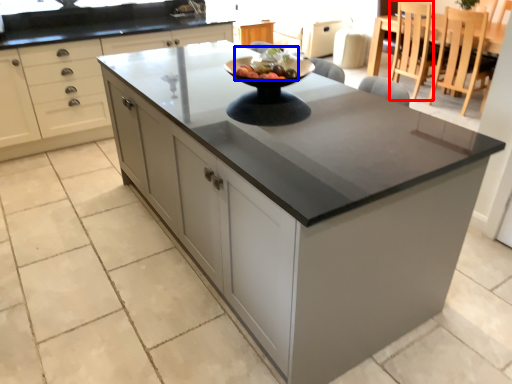
Question: Which object appears closest to the camera in this image, chair (highlighted by a red box) or fruit salad (highlighted by a blue box)?

Choices:
 (A) chair
 (B) fruit salad

Answer: (B)